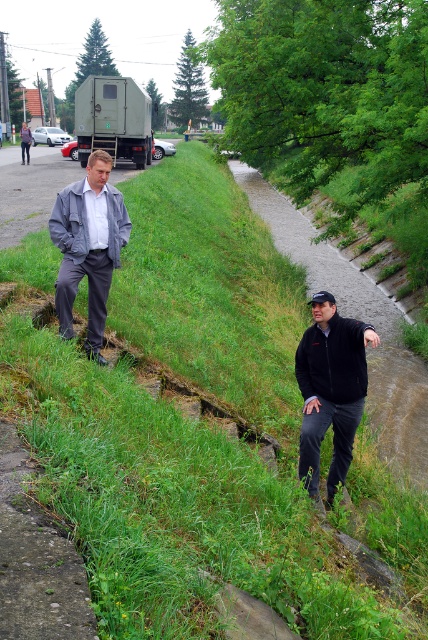
Question: Does black fleece jacket at center appear under gray matte jacket at left?

Choices:
 (A) yes
 (B) no

Answer: (A)

Question: Does black fleece jacket at center lie in front of gray matte jacket at left?

Choices:
 (A) no
 (B) yes

Answer: (B)

Question: In this image, where is black fleece jacket at center located relative to gray matte jacket at left?

Choices:
 (A) left
 (B) right

Answer: (B)

Question: Which object is farther from the camera taking this photo?

Choices:
 (A) black fleece jacket at center
 (B) gray matte jacket at left

Answer: (B)